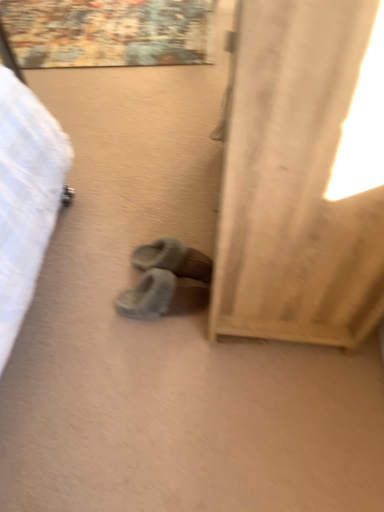
Question: Does beige fabric curtain at right lie in front of gray fuzzy slippers at center, the 2th footwear from the bottom?

Choices:
 (A) no
 (B) yes

Answer: (B)

Question: Can you confirm if beige fabric curtain at right is shorter than gray fuzzy slippers at center, the 2th footwear from the bottom?

Choices:
 (A) yes
 (B) no

Answer: (B)

Question: Can you confirm if beige fabric curtain at right is positioned to the left of gray fuzzy slippers at center, the 2th footwear from the bottom?

Choices:
 (A) yes
 (B) no

Answer: (B)

Question: Is the surface of beige fabric curtain at right in direct contact with gray fuzzy slippers at center, placed as the 1th footwear when sorted from top to bottom?

Choices:
 (A) yes
 (B) no

Answer: (B)

Question: Is beige fabric curtain at right at the right side of gray fuzzy slippers at center, placed as the 1th footwear when sorted from top to bottom?

Choices:
 (A) yes
 (B) no

Answer: (A)

Question: From a real-world perspective, is beige fabric curtain at right physically below gray fuzzy slippers at center, placed as the 1th footwear when sorted from top to bottom?

Choices:
 (A) yes
 (B) no

Answer: (B)

Question: Can you confirm if fuzzy suede slippers at center, placed as the 2th footwear when sorted from top to bottom, is wider than beige fabric curtain at right?

Choices:
 (A) no
 (B) yes

Answer: (A)

Question: Is fuzzy suede slippers at center, the 1th footwear when ordered from bottom to top, bigger than beige fabric curtain at right?

Choices:
 (A) yes
 (B) no

Answer: (B)

Question: Is fuzzy suede slippers at center, the 1th footwear when ordered from bottom to top, looking in the opposite direction of beige fabric curtain at right?

Choices:
 (A) no
 (B) yes

Answer: (B)

Question: Would you consider fuzzy suede slippers at center, placed as the 2th footwear when sorted from top to bottom, to be distant from beige fabric curtain at right?

Choices:
 (A) yes
 (B) no

Answer: (B)

Question: Is fuzzy suede slippers at center, the 1th footwear when ordered from bottom to top, to the left of beige fabric curtain at right from the viewer's perspective?

Choices:
 (A) yes
 (B) no

Answer: (A)

Question: Can you confirm if fuzzy suede slippers at center, the 1th footwear when ordered from bottom to top, is thinner than beige fabric curtain at right?

Choices:
 (A) no
 (B) yes

Answer: (B)

Question: Considering the relative sizes of gray fuzzy slippers at center, the 2th footwear from the bottom, and beige fabric curtain at right in the image provided, is gray fuzzy slippers at center, the 2th footwear from the bottom, shorter than beige fabric curtain at right?

Choices:
 (A) no
 (B) yes

Answer: (B)